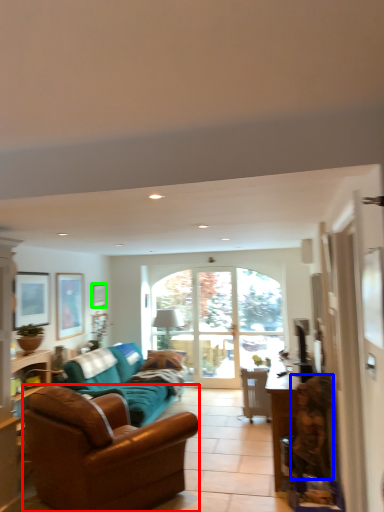
Question: Estimate the real-world distances between objects in this image. Which object is closer to studio couch (highlighted by a red box), person (highlighted by a blue box) or picture frame (highlighted by a green box)?

Choices:
 (A) person
 (B) picture frame

Answer: (A)